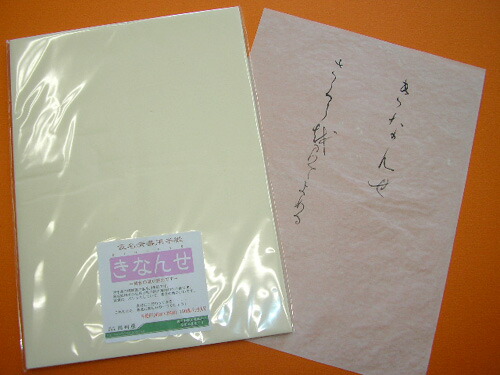
Locate an element on the screen. Image resolution: width=500 pixels, height=375 pixels. orange table is located at coordinates (256, 357).